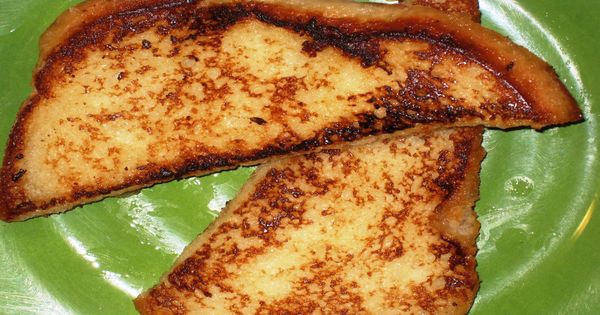
Identify the location of grease smudges on plate. This screenshot has height=315, width=600. (512, 189), (504, 237).